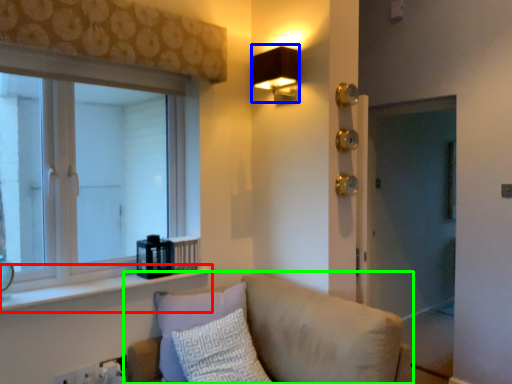
Question: Which is nearer to the window sill (highlighted by a red box)? fixture (highlighted by a blue box) or studio couch (highlighted by a green box).

Choices:
 (A) fixture
 (B) studio couch

Answer: (B)